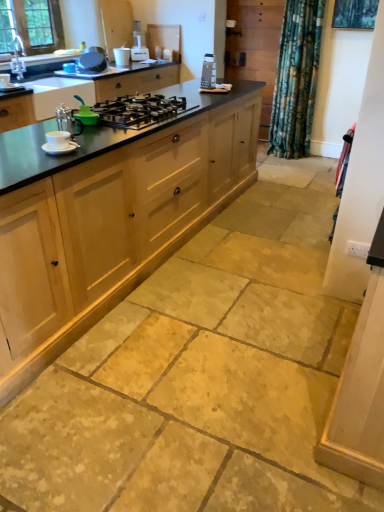
Question: Is natural wood cabinetry at center oriented away from matte silver sink at upper left?

Choices:
 (A) no
 (B) yes

Answer: (B)

Question: Is natural wood cabinetry at center positioned behind matte silver sink at upper left?

Choices:
 (A) no
 (B) yes

Answer: (A)

Question: Can you confirm if natural wood cabinetry at center is positioned to the left of matte silver sink at upper left?

Choices:
 (A) no
 (B) yes

Answer: (A)

Question: From the image's perspective, is natural wood cabinetry at center on top of matte silver sink at upper left?

Choices:
 (A) no
 (B) yes

Answer: (A)

Question: Considering the relative sizes of natural wood cabinetry at center and matte silver sink at upper left in the image provided, is natural wood cabinetry at center bigger than matte silver sink at upper left?

Choices:
 (A) no
 (B) yes

Answer: (B)

Question: Is metallic silver pot at upper center, which is counted as the 3th appliance, starting from the right, bigger or smaller than white glossy screen door at right?

Choices:
 (A) big
 (B) small

Answer: (B)

Question: Would you say metallic silver pot at upper center, the 1th appliance when ordered from top to bottom, is inside or outside white glossy screen door at right?

Choices:
 (A) outside
 (B) inside

Answer: (A)

Question: Considering the positions of metallic silver pot at upper center, which appears as the 3th appliance when ordered from the bottom, and white glossy screen door at right in the image, is metallic silver pot at upper center, which appears as the 3th appliance when ordered from the bottom, taller or shorter than white glossy screen door at right?

Choices:
 (A) tall
 (B) short

Answer: (B)

Question: From the image's perspective, relative to white glossy screen door at right, is metallic silver pot at upper center, which is the first appliance from back to front, above or below?

Choices:
 (A) below
 (B) above

Answer: (B)

Question: Is natural wood cabinetry at center inside or outside of black matte gas stove at center?

Choices:
 (A) inside
 (B) outside

Answer: (B)

Question: Is natural wood cabinetry at center taller or shorter than black matte gas stove at center?

Choices:
 (A) tall
 (B) short

Answer: (A)

Question: In the image, is natural wood cabinetry at center positioned in front of or behind black matte gas stove at center?

Choices:
 (A) behind
 (B) front

Answer: (B)

Question: From the image's perspective, relative to black matte gas stove at center, is natural wood cabinetry at center above or below?

Choices:
 (A) below
 (B) above

Answer: (A)

Question: In terms of width, does matte silver sink at upper left look wider or thinner when compared to black matte gas stove at center?

Choices:
 (A) thin
 (B) wide

Answer: (A)

Question: In the image, is matte silver sink at upper left positioned in front of or behind black matte gas stove at center?

Choices:
 (A) behind
 (B) front

Answer: (A)